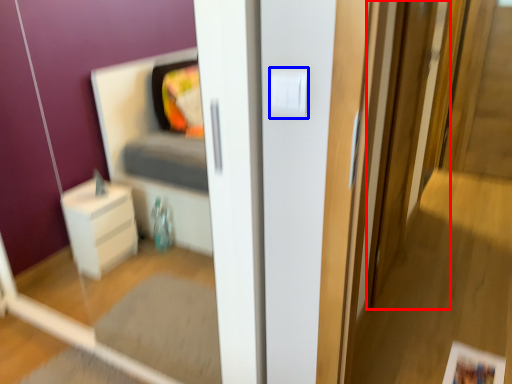
Question: Which point is closer to the camera, screen door (highlighted by a red box) or light switch (highlighted by a blue box)?

Choices:
 (A) screen door
 (B) light switch

Answer: (B)